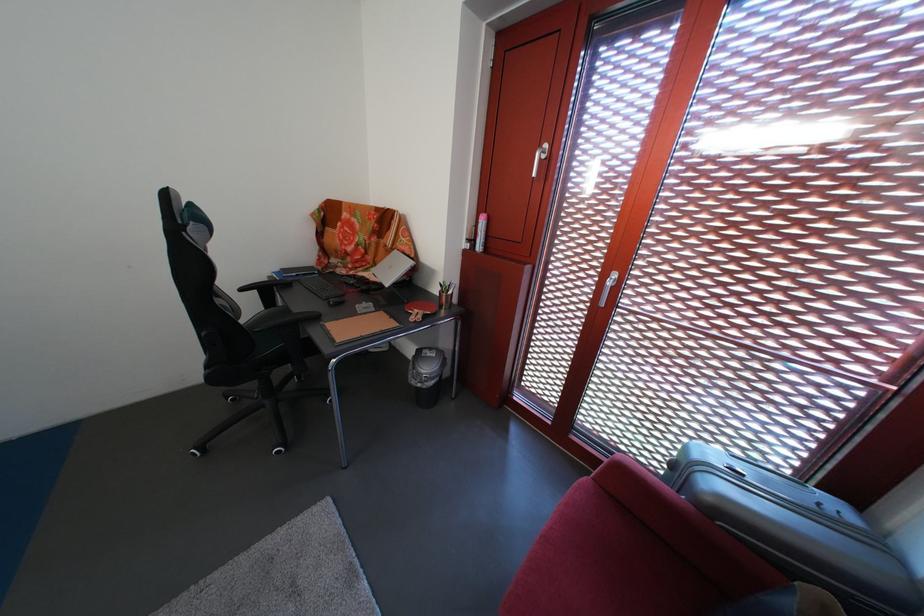
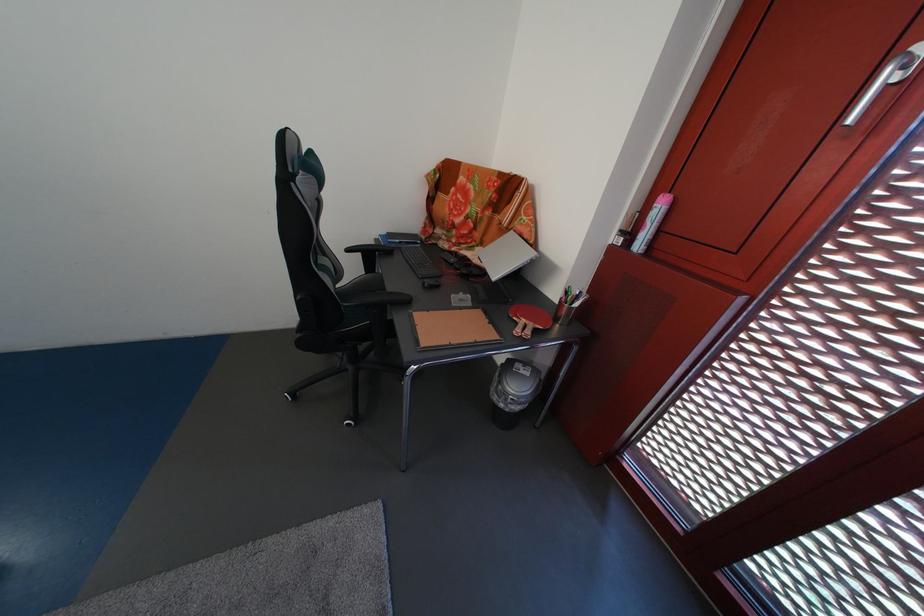
Question: Based on the continuous images, in which direction is the camera rotating? Reply with the corresponding letter.

Choices:
 (A) Left
 (B) Right
 (C) Up
 (D) Down

Answer: (A)